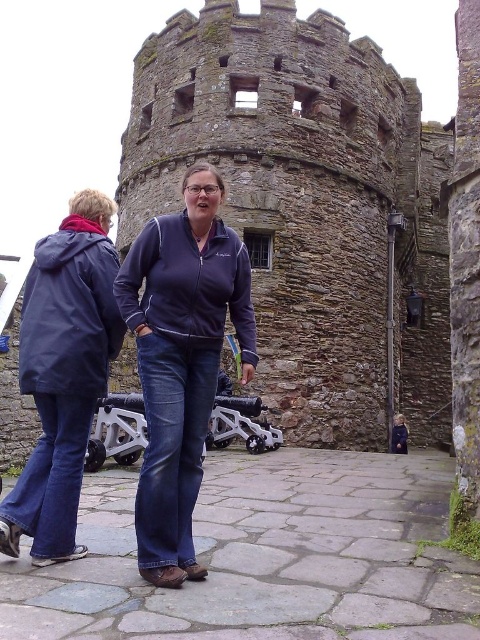
Does dark brown stone tower at center have a lesser height compared to matte blue jacket at center?

No, dark brown stone tower at center is not shorter than matte blue jacket at center.

Is dark brown stone tower at center wider than matte blue jacket at center?

Yes.

Describe the element at coordinates (308, 208) in the screenshot. The height and width of the screenshot is (640, 480). I see `dark brown stone tower at center` at that location.

Locate an element on the screen. dark brown stone tower at center is located at coordinates (308, 208).

Between dark brown stone tower at center and navy blue fleece at center, which one has more height?

dark brown stone tower at center

Is dark brown stone tower at center wider than navy blue fleece at center?

Yes, dark brown stone tower at center is wider than navy blue fleece at center.

Where is `dark brown stone tower at center`? Image resolution: width=480 pixels, height=640 pixels. dark brown stone tower at center is located at coordinates (308, 208).

What are the coordinates of `dark brown stone tower at center` in the screenshot? It's located at (308, 208).

Does point (176, 572) come farther from viewer compared to point (405, 436)?

No, it is in front of (405, 436).

Based on the photo, is navy blue fleece at center above dark blue jeans at center?

Correct, navy blue fleece at center is located above dark blue jeans at center.

Is point (224, 189) farther from camera compared to point (400, 413)?

That is False.

Locate an element on the screen. navy blue fleece at center is located at coordinates (181, 360).